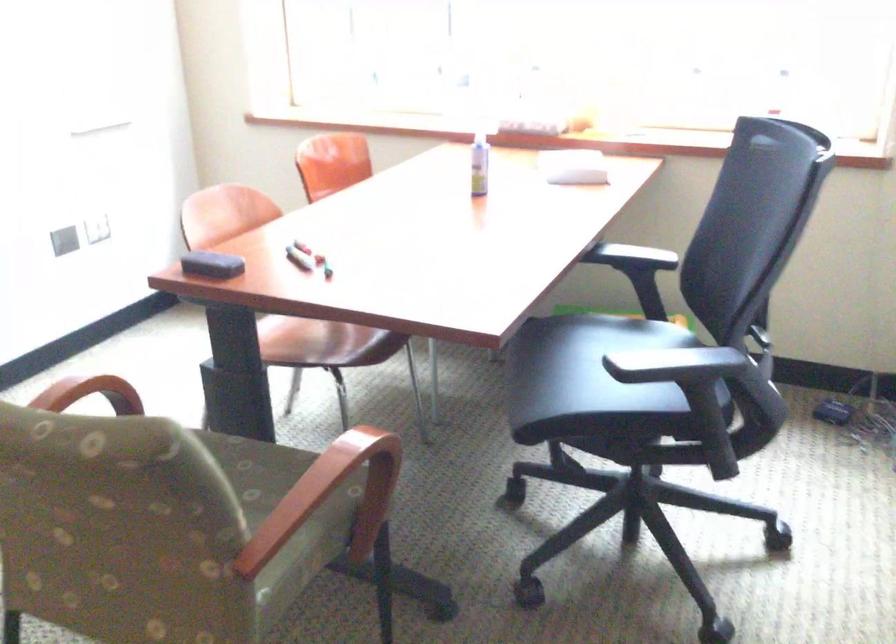
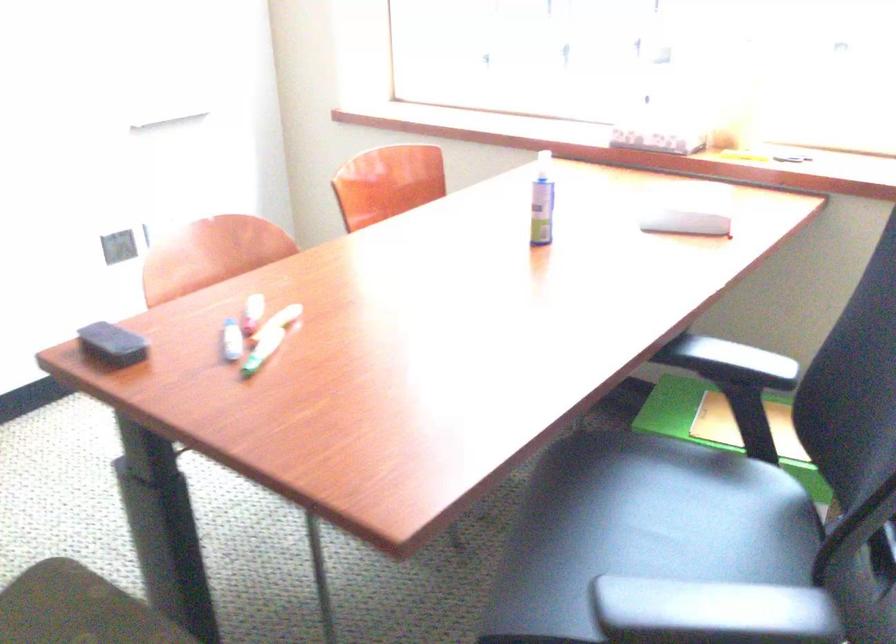
In a continuous first-person perspective shot, in which direction is the camera moving?

The cameraman moved toward right, forward.